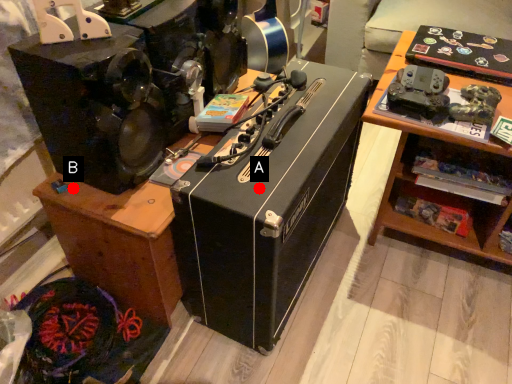
Question: Two points are circled on the image, labeled by A and B beside each circle. Among these points, which one is farthest from the camera?

Choices:
 (A) A is further
 (B) B is further

Answer: (B)